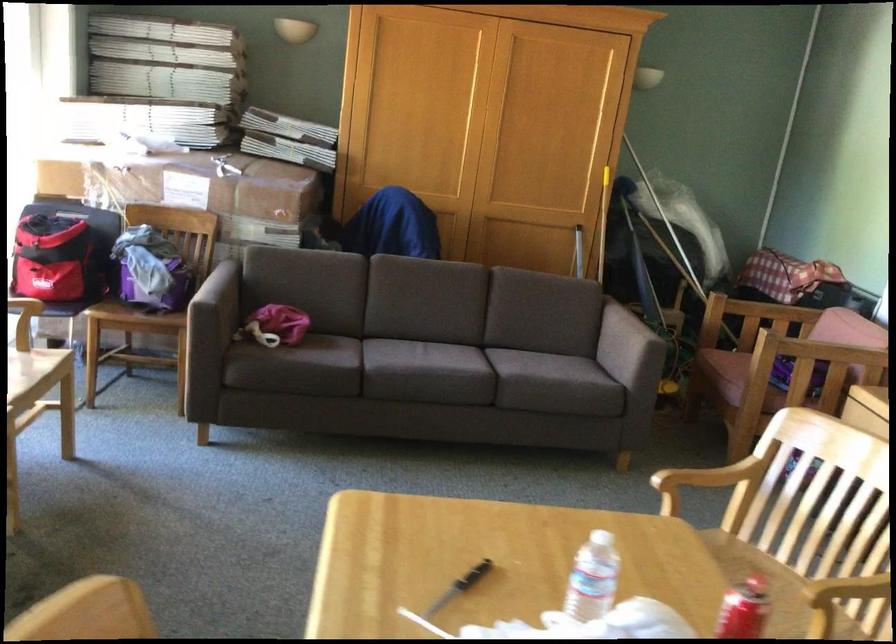
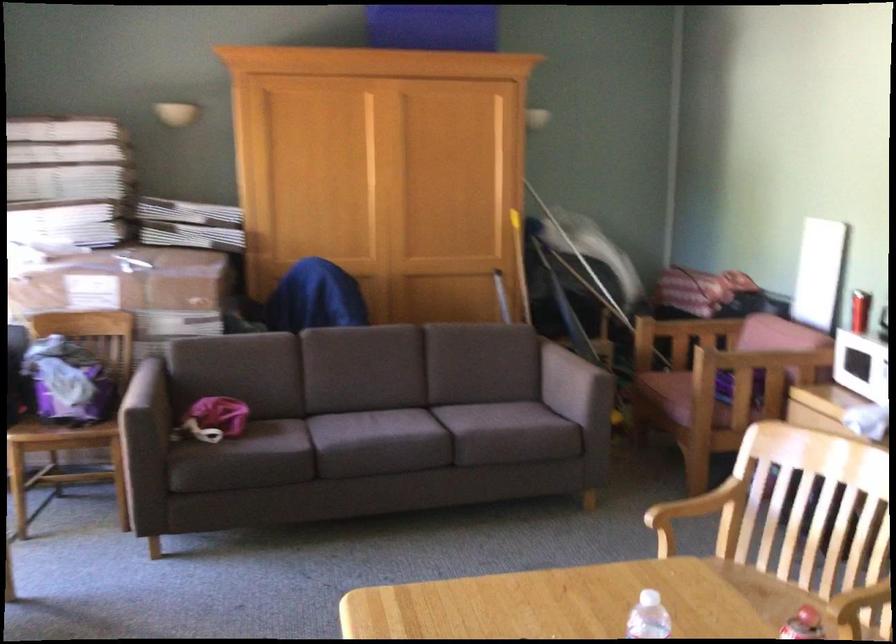
Question: The camera is either moving clockwise (left) or counter-clockwise (right) around the object. The first image is from the beginning of the video and the second image is from the end. Is the camera moving left or right when shooting the video?

Choices:
 (A) Left
 (B) Right

Answer: (A)